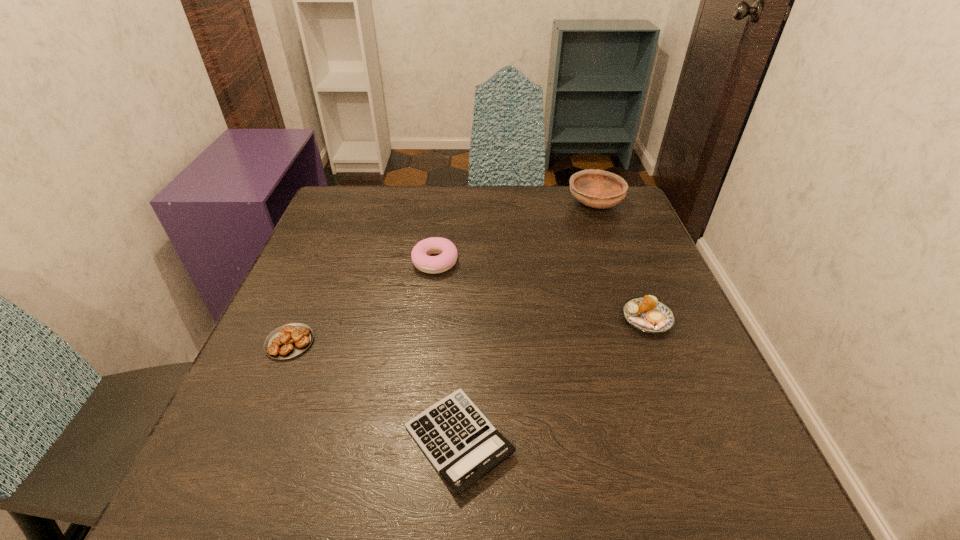
Image resolution: width=960 pixels, height=540 pixels. Identify the location of bowl. (600, 189).

Find the location of a particular element. This screenshot has width=960, height=540. the tallest object is located at coordinates (600, 189).

Identify the location of the second farthest object. (420, 253).

Image resolution: width=960 pixels, height=540 pixels. Identify the location of the second pastry from right to left. (420, 253).

You are a GUI agent. You are given a task and a screenshot of the screen. Output one action in this format:
    pyautogui.click(x=<x>, y=<y>)
    Task: Click on the third shortest object
    Image resolution: width=960 pixels, height=540 pixels.
    Given the screenshot: What is the action you would take?
    pyautogui.click(x=648, y=314)

Find the location of a particular element. The image size is (960, 540). the rightmost pastry is located at coordinates (648, 314).

I want to click on the leftmost object, so 290,340.

The width and height of the screenshot is (960, 540). In order to click on the second shortest object in this screenshot , I will do `click(290, 340)`.

Locate an element on the screen. The height and width of the screenshot is (540, 960). calculator is located at coordinates (461, 443).

You are a GUI agent. You are given a task and a screenshot of the screen. Output one action in this format:
    pyautogui.click(x=<x>, y=<y>)
    Task: Click on the nearest object
    This screenshot has width=960, height=540.
    Given the screenshot: What is the action you would take?
    pyautogui.click(x=461, y=443)